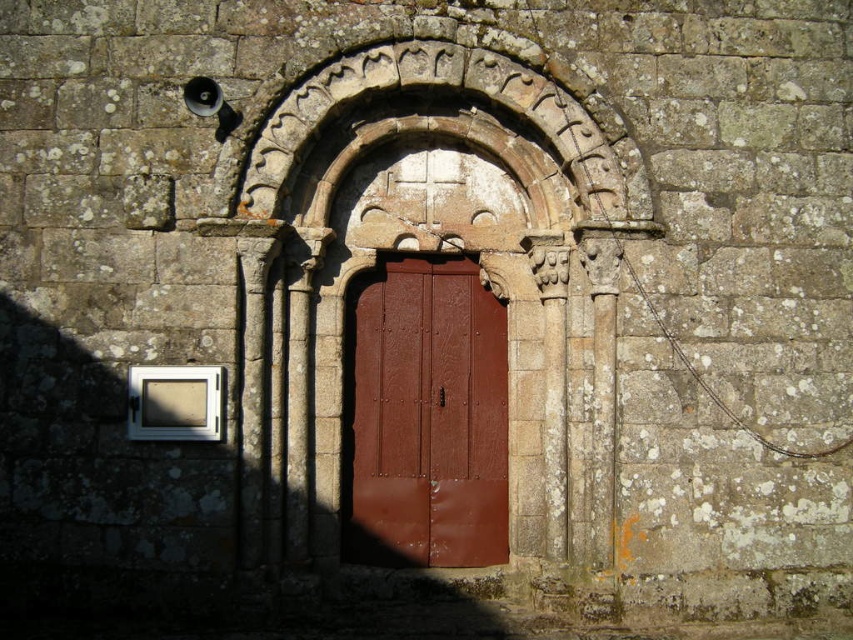
Question: Can you confirm if stone carved archway at center is bigger than matte brown wooden door at center?

Choices:
 (A) no
 (B) yes

Answer: (B)

Question: Considering the relative positions of stone carved archway at center and matte brown wooden door at center in the image provided, where is stone carved archway at center located with respect to matte brown wooden door at center?

Choices:
 (A) left
 (B) right

Answer: (B)

Question: Considering the relative positions of stone carved archway at center and matte brown wooden door at center in the image provided, where is stone carved archway at center located with respect to matte brown wooden door at center?

Choices:
 (A) above
 (B) below

Answer: (A)

Question: Which point appears closest to the camera in this image?

Choices:
 (A) (544, 435)
 (B) (473, 509)

Answer: (A)

Question: Among these points, which one is nearest to the camera?

Choices:
 (A) coord(346,465)
 (B) coord(476,381)

Answer: (A)